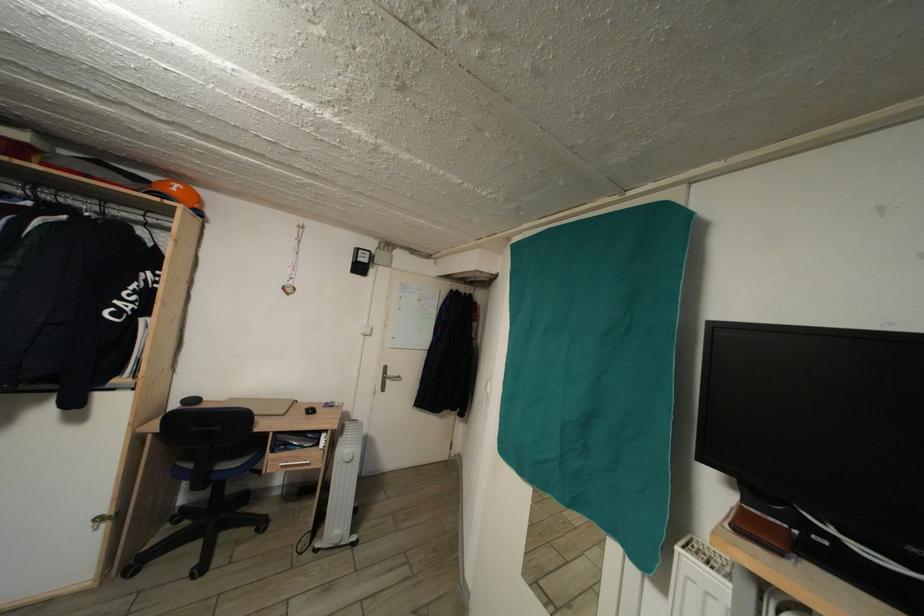
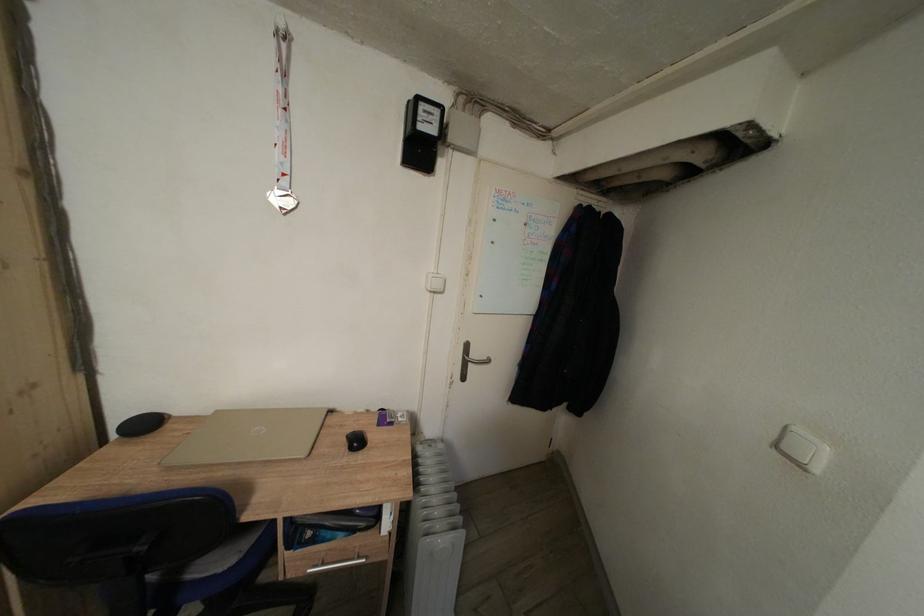
The images are taken continuously from a first-person perspective. In which direction are you moving?

The cameraman walked toward left, forward.